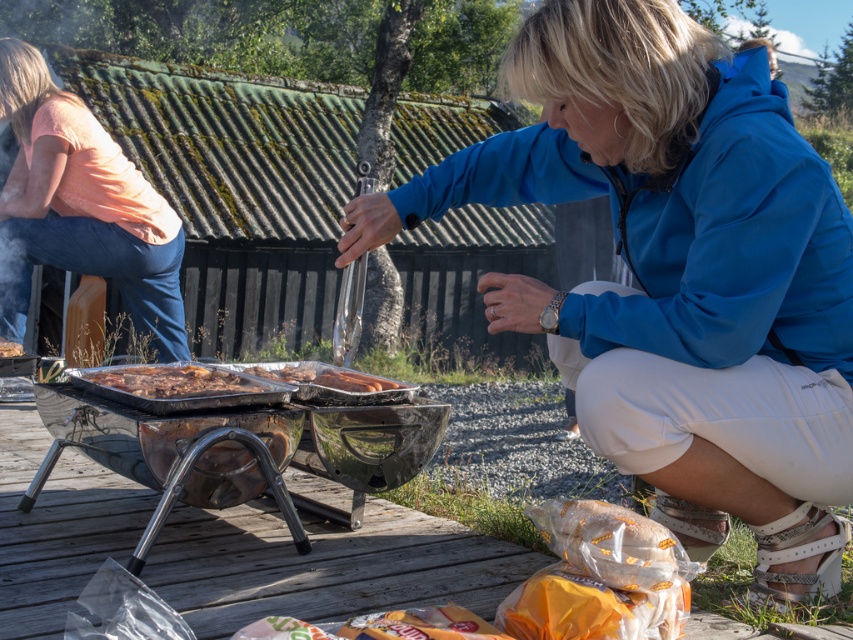
Question: Which object is positioned farthest from the shiny metallic tray at center?

Choices:
 (A) golden brown meat at center
 (B) matte peach shirt at upper left
 (C) blue fabric jacket at center
 (D) slightly charred aluminum foil at center

Answer: (A)

Question: Which point is closer to the camera?

Choices:
 (A) golden brown meat at center
 (B) shiny metallic tray at center
 (C) matte peach shirt at upper left

Answer: (B)

Question: Where is shiny metallic tray at center located in relation to golden brown meat at center in the image?

Choices:
 (A) below
 (B) above

Answer: (A)

Question: Where is shiny metallic tray at center located in relation to slightly charred aluminum foil at center in the image?

Choices:
 (A) left
 (B) right

Answer: (A)

Question: Which object appears farthest from the camera in this image?

Choices:
 (A) matte peach shirt at upper left
 (B) blue fabric jacket at center
 (C) shiny metallic tray at center

Answer: (A)

Question: Can you confirm if shiny metallic tray at center is positioned to the right of slightly charred aluminum foil at center?

Choices:
 (A) yes
 (B) no

Answer: (B)